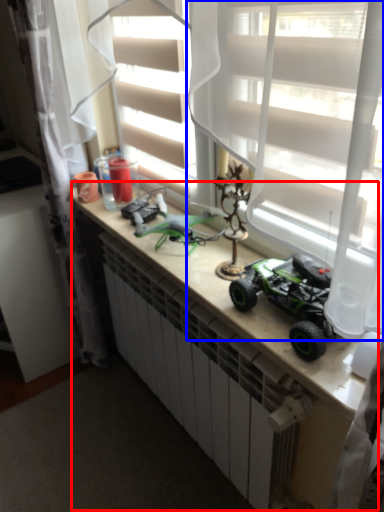
Question: Among these objects, which one is nearest to the camera, counter (highlighted by a red box) or curtain (highlighted by a blue box)?

Choices:
 (A) counter
 (B) curtain

Answer: (B)